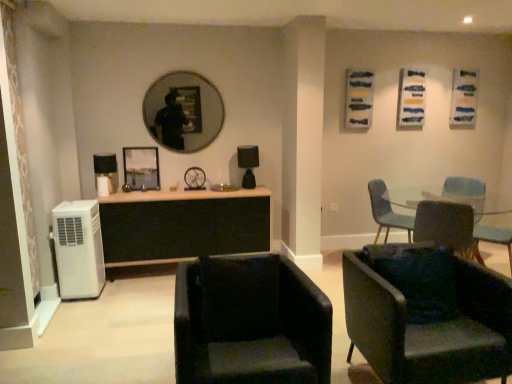
Question: Considering the relative positions of metallic silver picture frame at center and velvet green armchair at lower right, acting as the 3th chair starting from the back, in the image provided, is metallic silver picture frame at center in front of velvet green armchair at lower right, acting as the 3th chair starting from the back,?

Choices:
 (A) no
 (B) yes

Answer: (A)

Question: Does metallic silver picture frame at center have a smaller size compared to velvet green armchair at lower right, which is the 2th chair in front-to-back order?

Choices:
 (A) yes
 (B) no

Answer: (A)

Question: Can you confirm if metallic silver picture frame at center is wider than velvet green armchair at lower right, which is the 2th chair in front-to-back order?

Choices:
 (A) yes
 (B) no

Answer: (B)

Question: Considering the relative sizes of metallic silver picture frame at center and velvet green armchair at lower right, acting as the 3th chair starting from the back, in the image provided, is metallic silver picture frame at center taller than velvet green armchair at lower right, acting as the 3th chair starting from the back,?

Choices:
 (A) no
 (B) yes

Answer: (A)

Question: Does metallic silver picture frame at center have a lesser width compared to velvet green armchair at lower right, acting as the 3th chair starting from the back?

Choices:
 (A) yes
 (B) no

Answer: (A)

Question: Is metallic silver picture frame at center to the right of velvet green armchair at lower right, acting as the 3th chair starting from the back, from the viewer's perspective?

Choices:
 (A) no
 (B) yes

Answer: (A)

Question: Can you confirm if matte black mirror at upper center is bigger than black wood cabinet at center?

Choices:
 (A) yes
 (B) no

Answer: (B)

Question: Considering the relative positions of matte black mirror at upper center and black wood cabinet at center in the image provided, is matte black mirror at upper center to the right of black wood cabinet at center from the viewer's perspective?

Choices:
 (A) no
 (B) yes

Answer: (A)

Question: Considering the relative positions of matte black mirror at upper center and black wood cabinet at center in the image provided, is matte black mirror at upper center to the left of black wood cabinet at center from the viewer's perspective?

Choices:
 (A) yes
 (B) no

Answer: (A)

Question: From the image's perspective, is matte black mirror at upper center on black wood cabinet at center?

Choices:
 (A) no
 (B) yes

Answer: (B)

Question: Is matte black mirror at upper center placed right next to black wood cabinet at center?

Choices:
 (A) no
 (B) yes

Answer: (A)

Question: Would you say black wood cabinet at center is part of matte black mirror at upper center's contents?

Choices:
 (A) no
 (B) yes

Answer: (A)

Question: Are black leather chair at lower center, placed as the fourth chair when sorted from back to front, and matte black mirror at upper center making contact?

Choices:
 (A) no
 (B) yes

Answer: (A)